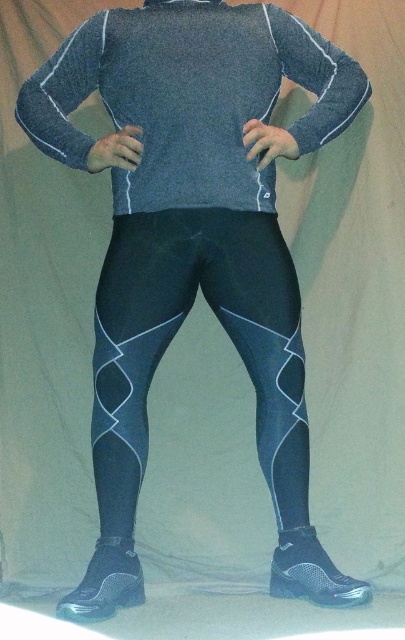
Question: In this image, where is matte gray sweater at center located relative to matte black leggings at center?

Choices:
 (A) below
 (B) above

Answer: (B)

Question: Which point is closer to the camera?

Choices:
 (A) (247, 10)
 (B) (168, 344)

Answer: (A)

Question: Can you confirm if matte gray sweater at center is positioned below matte black leggings at center?

Choices:
 (A) yes
 (B) no

Answer: (B)

Question: Does matte gray sweater at center appear over matte black leggings at center?

Choices:
 (A) yes
 (B) no

Answer: (A)